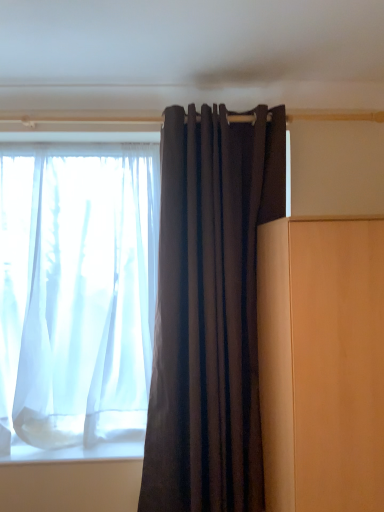
Question: From the image's perspective, would you say sheer white curtain at left, the second curtain in the front-to-back sequence, is shown under matte wood cabinet at right?

Choices:
 (A) yes
 (B) no

Answer: (B)

Question: Are sheer white curtain at left, the second curtain in the front-to-back sequence, and matte wood cabinet at right making contact?

Choices:
 (A) yes
 (B) no

Answer: (B)

Question: From the image's perspective, would you say sheer white curtain at left, the second curtain in the front-to-back sequence, is positioned over matte wood cabinet at right?

Choices:
 (A) yes
 (B) no

Answer: (A)

Question: Is sheer white curtain at left, which ranks as the second curtain in right-to-left order, wider than matte wood cabinet at right?

Choices:
 (A) no
 (B) yes

Answer: (A)

Question: Does sheer white curtain at left, the second curtain in the front-to-back sequence, have a larger size compared to matte wood cabinet at right?

Choices:
 (A) no
 (B) yes

Answer: (A)

Question: Is point (342, 276) closer or farther from the camera than point (206, 397)?

Choices:
 (A) closer
 (B) farther

Answer: (A)

Question: In the image, is matte wood cabinet at right positioned in front of or behind dark matte fabric curtain at center, positioned as the 2th curtain in left-to-right order?

Choices:
 (A) front
 (B) behind

Answer: (A)

Question: Choose the correct answer: Is matte wood cabinet at right inside dark matte fabric curtain at center, the first curtain positioned from the front, or outside it?

Choices:
 (A) inside
 (B) outside

Answer: (B)

Question: In terms of size, does matte wood cabinet at right appear bigger or smaller than dark matte fabric curtain at center, which is counted as the 2th curtain, starting from the back?

Choices:
 (A) big
 (B) small

Answer: (A)

Question: From a real-world perspective, relative to matte wood cabinet at right, is dark matte fabric curtain at center, which is the first curtain in right-to-left order, vertically above or below?

Choices:
 (A) below
 (B) above

Answer: (B)

Question: Is point (177, 239) closer or farther from the camera than point (377, 477)?

Choices:
 (A) closer
 (B) farther

Answer: (B)

Question: From their relative heights in the image, would you say dark matte fabric curtain at center, which is the first curtain in right-to-left order, is taller or shorter than matte wood cabinet at right?

Choices:
 (A) short
 (B) tall

Answer: (B)

Question: Would you say dark matte fabric curtain at center, which is counted as the 2th curtain, starting from the back, is inside or outside matte wood cabinet at right?

Choices:
 (A) inside
 (B) outside

Answer: (B)

Question: From a real-world perspective, is sheer white curtain at left, which ranks as the second curtain in right-to-left order, above or below matte wood cabinet at right?

Choices:
 (A) below
 (B) above

Answer: (B)

Question: Is sheer white curtain at left, marked as the 1th curtain in a left-to-right arrangement, bigger or smaller than matte wood cabinet at right?

Choices:
 (A) big
 (B) small

Answer: (B)